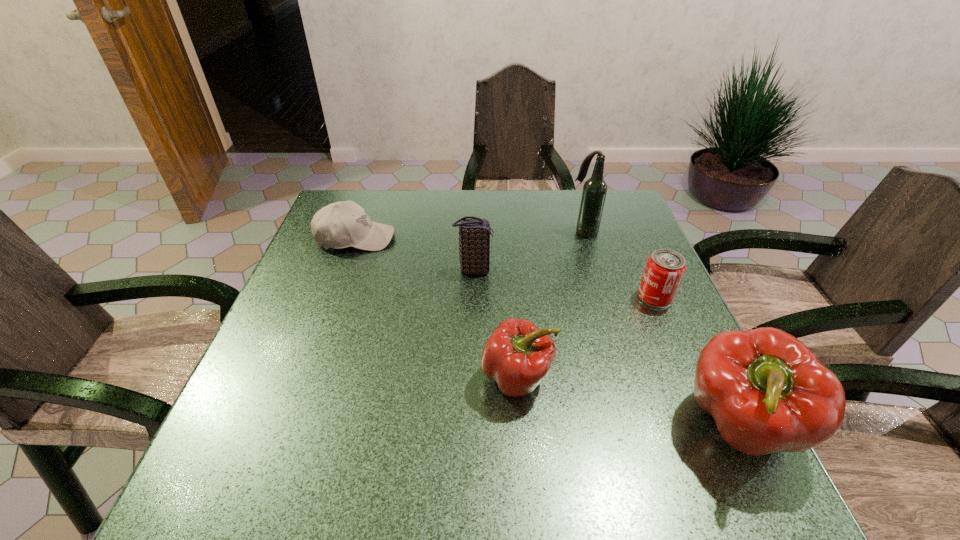
Please show where to add a pepper on the left while keeping spacing even. Please provide its 2D coordinates. Your answer should be formatted as a tuple, i.e. [(x, y)], where the tuple contains the x and y coordinates of a point satisfying the conditions above.

[(333, 337)]